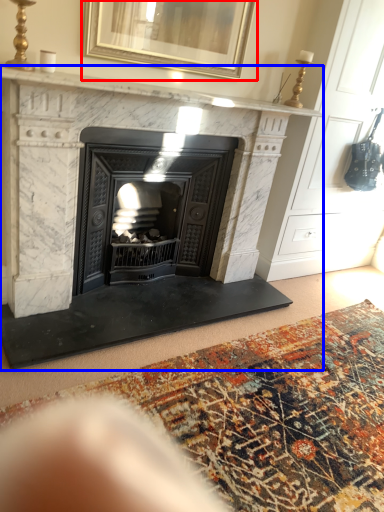
Question: Which of the following is the farthest to the observer, picture frame (highlighted by a red box) or fireplace (highlighted by a blue box)?

Choices:
 (A) picture frame
 (B) fireplace

Answer: (A)